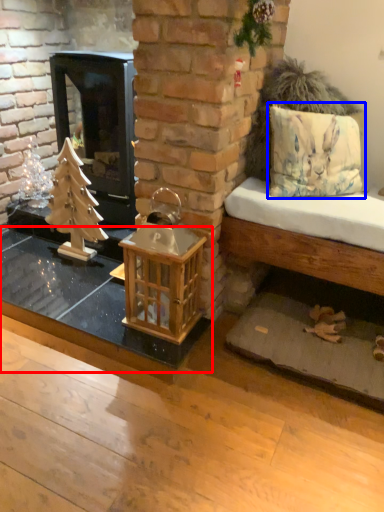
Question: Which of the following is the farthest to the observer, table (highlighted by a red box) or pillow (highlighted by a blue box)?

Choices:
 (A) table
 (B) pillow

Answer: (A)